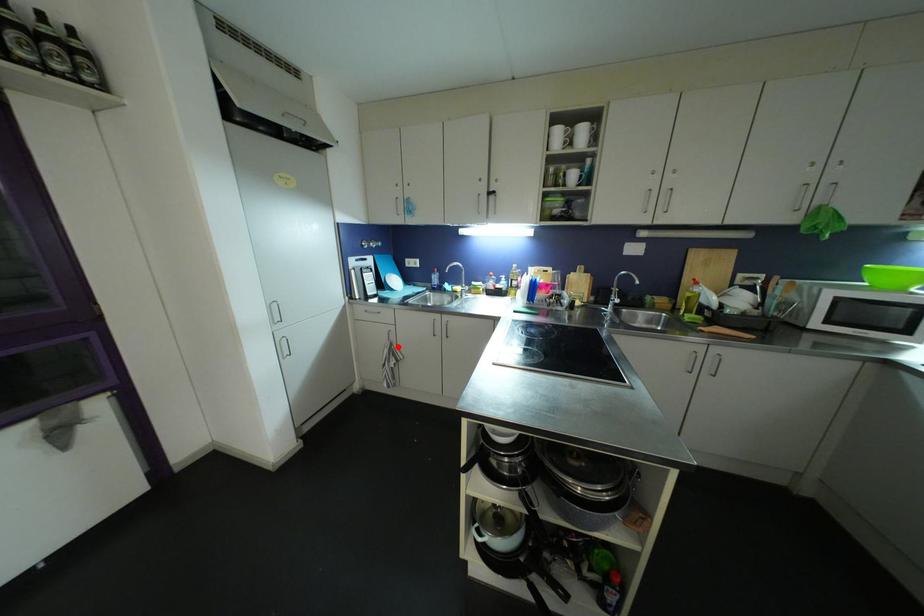
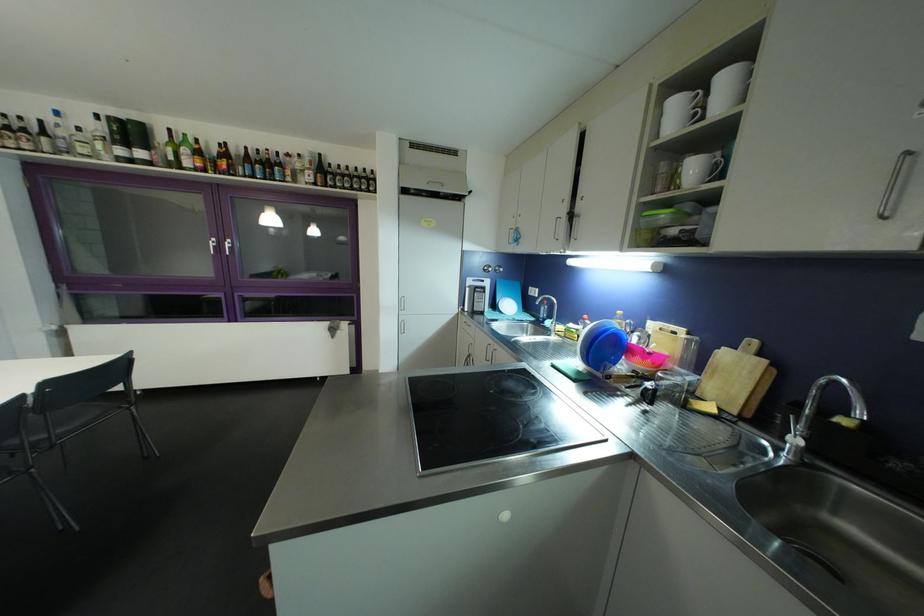
Question: I am providing you with two images of the same scene from different viewpoints. Image1 has a red point marked. In image2, the corresponding 3D location appears at what relative position? Reply with the corresponding letter.

Choices:
 (A) Closer
 (B) Farther

Answer: (A)